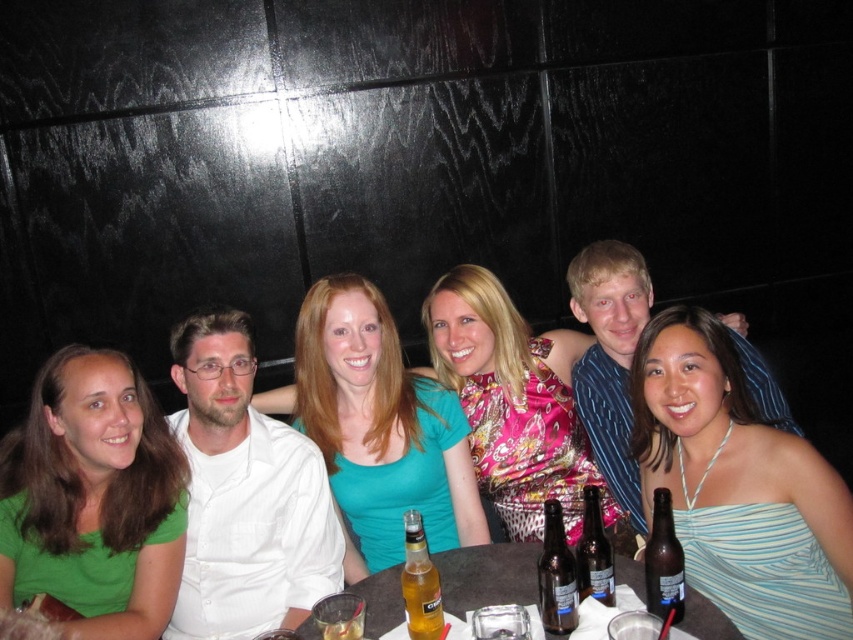
Question: Is smooth dark wood table at center further to camera compared to translucent glass bottle at center?

Choices:
 (A) no
 (B) yes

Answer: (A)

Question: Which point is farther to the camera?

Choices:
 (A) shiny silk dress at center
 (B) brown glass bottle at center
 (C) translucent yellow glass bottle at lower center
 (D) smooth dark wood table at center

Answer: (A)

Question: Can you confirm if smooth dark wood table at center is bigger than translucent yellow glass bottle at lower center?

Choices:
 (A) yes
 (B) no

Answer: (A)

Question: Is translucent yellow glass bottle at lower center smaller than translucent glass bottle at center?

Choices:
 (A) no
 (B) yes

Answer: (A)

Question: Which point is closer to the camera?

Choices:
 (A) green matte shirt at left
 (B) brown glass bottle at lower right
 (C) smooth dark wood table at center

Answer: (B)

Question: Which point is farther from the camera taking this photo?

Choices:
 (A) (73, 349)
 (B) (660, 376)
 (C) (408, 625)
 (D) (338, 298)

Answer: (D)